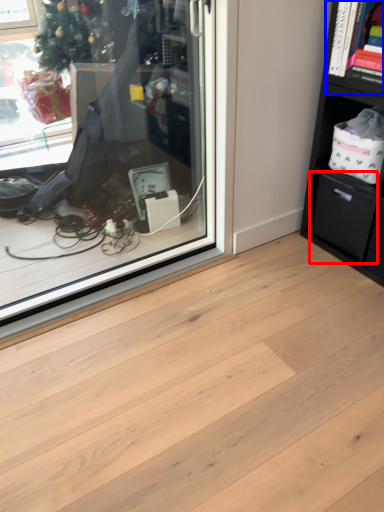
Question: Which object appears closest to the camera in this image, drawer (highlighted by a red box) or cabinet (highlighted by a blue box)?

Choices:
 (A) drawer
 (B) cabinet

Answer: (B)